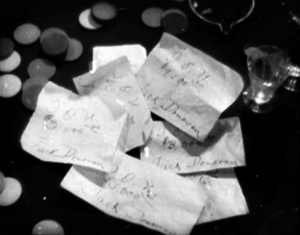
Identify the location of glass cup. (263, 90).